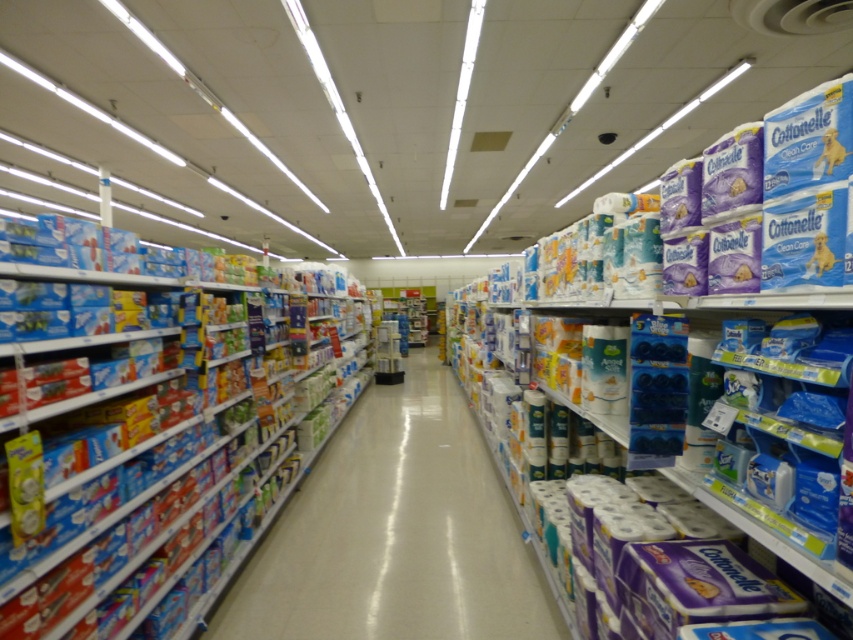
Between white paper towels at center and blue cardboard boxes at left, which one is positioned lower?

white paper towels at center

Does white paper towels at center have a greater height compared to blue cardboard boxes at left?

Incorrect, white paper towels at center's height is not larger of blue cardboard boxes at left's.

Is point (337, 480) farther from viewer compared to point (219, 508)?

Yes, point (337, 480) is farther from viewer.

Find the location of `white paper towels at center`. white paper towels at center is located at coordinates (395, 532).

The width and height of the screenshot is (853, 640). I want to click on white paper towels at right, so click(x=672, y=422).

Is point (531, 419) in front of point (480, 609)?

No, (531, 419) is further to viewer.

Locate an element on the screen. white paper towels at right is located at coordinates (672, 422).

What do you see at coordinates (672, 422) in the screenshot?
I see `white paper towels at right` at bounding box center [672, 422].

Where is `white paper towels at right`? white paper towels at right is located at coordinates (672, 422).